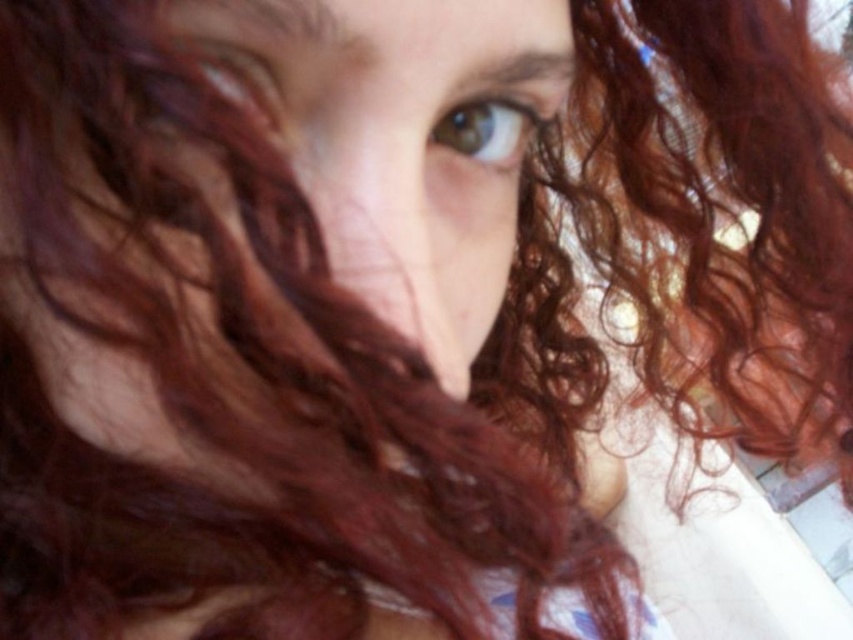
You are a photographer trying to capture a closeup of a person. You want to ensure that the point at point (230, 90) is in focus. If your camera has a depth of field that can only keep objects within 8 inches from the current focus point sharp, should you adjust the focus? Explain your reasoning.

The point (230, 90) is 8.38 inches away from the camera. Since the depth of field can only keep objects within 8 inches sharp, the point is slightly beyond the depth of field range. Therefore, you should adjust the focus to ensure the point is within the 8 inch limit.

You are a photographer trying to adjust the focus of your camera. You want to ensure the curly hair at center is in focus. According to the image, where should you adjust the focus point to?

You should adjust the focus point to coordinates point (399,138) to ensure the curly hair at center is in focus.

You are an artist trying to sketch this face. You need to place the curly hair at center and the brown matte eye at upper center. According to the image, which object should you draw first to maintain the correct spatial relationship?

The curly hair at center should be drawn first because it is positioned to the left of the brown matte eye at upper center, so starting with the hair ensures proper placement relative to the eye.